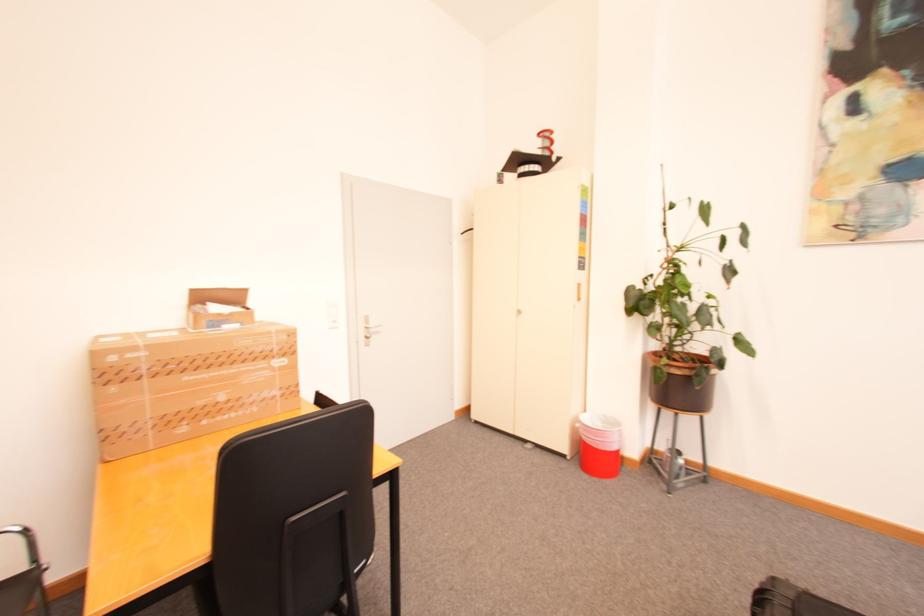
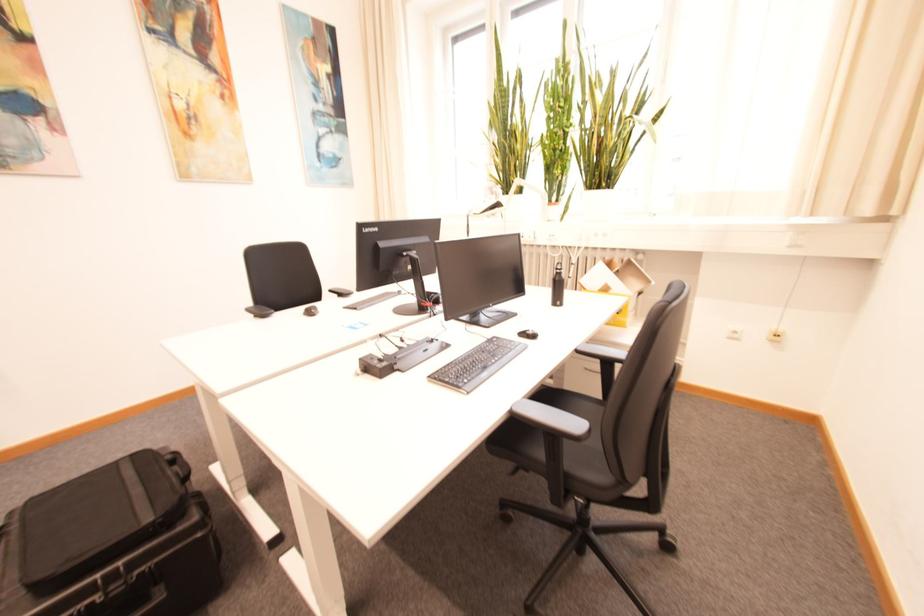
The first image is from the beginning of the video and the second image is from the end. How did the camera likely rotate when shooting the video?

The camera rotated toward right-down.